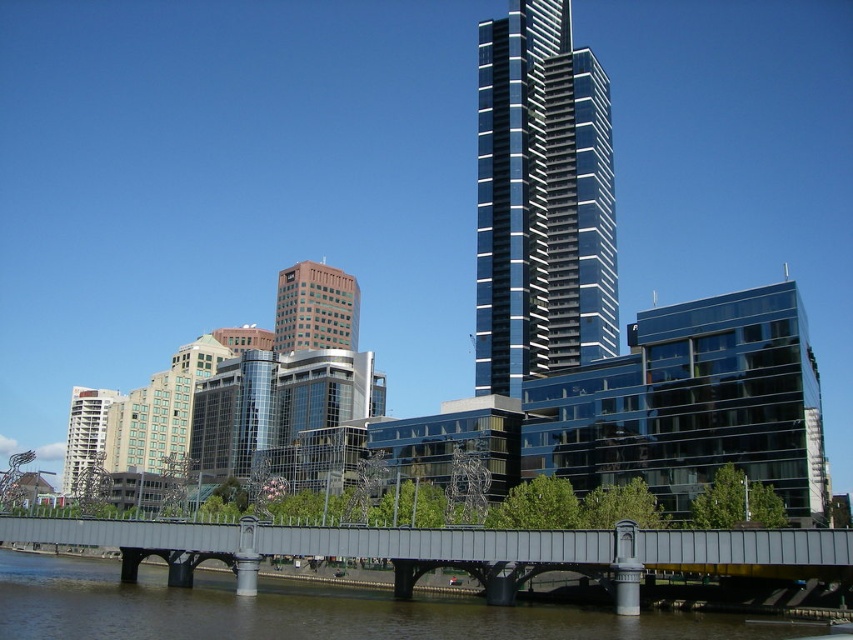
You are a city planner reviewing this urban layout. You notice the metallic gray bridge at center and the orange glass building at center. Which object is located to the right of the other?

The metallic gray bridge at center is positioned on the right side of orange glass building at center, so the metallic gray bridge at center is to the right of the orange glass building at center.

You are standing on the pedestrian bridge and looking at the point marked at coordinates (541, 200). Which object in the scene does this point belong to?

The point at coordinates (541, 200) belongs to the glossy glass skyscraper at center.